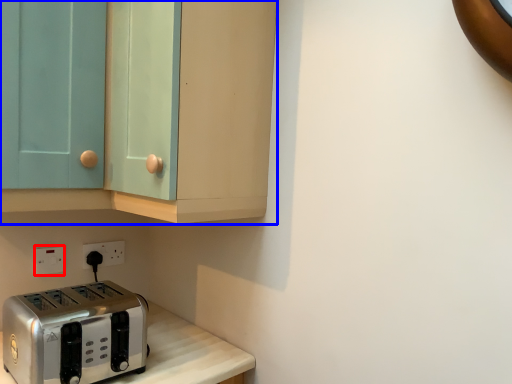
Question: Which point is further to the camera, electric outlet (highlighted by a red box) or cabinetry (highlighted by a blue box)?

Choices:
 (A) electric outlet
 (B) cabinetry

Answer: (A)